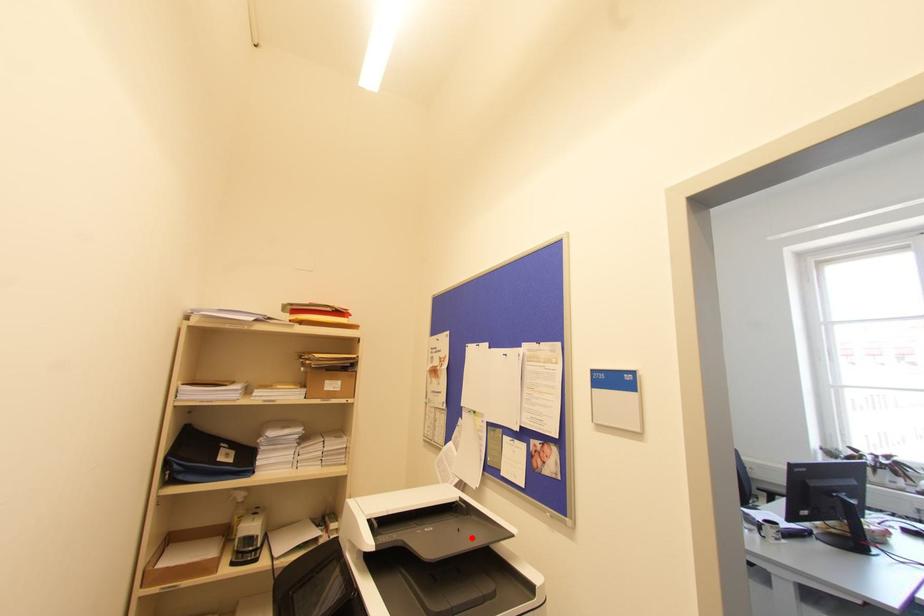
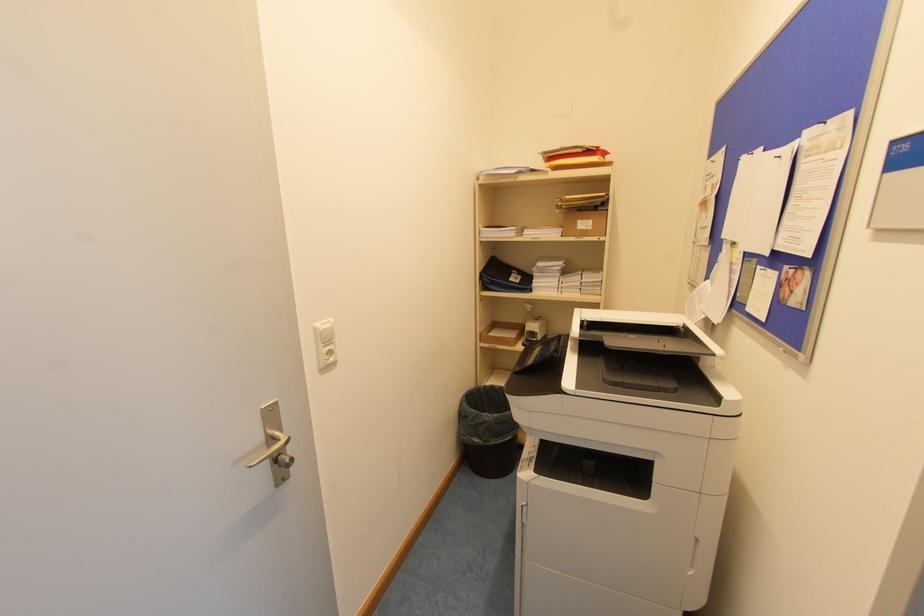
In the second image, find the point that corresponds to the highlighted location in the first image.

(663, 346)